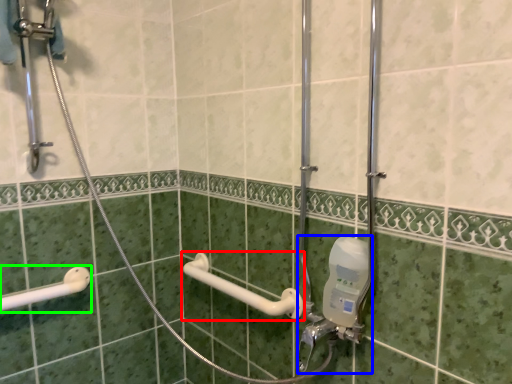
Question: Considering the real-world distances, which object is farthest from towel bar (highlighted by a red box)? plumbing fixture (highlighted by a blue box) or shower (highlighted by a green box)?

Choices:
 (A) plumbing fixture
 (B) shower

Answer: (B)